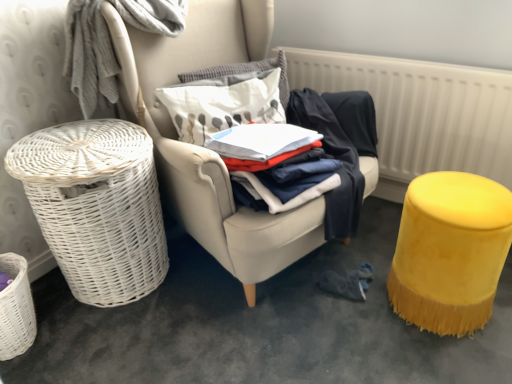
At what (x,y) coordinates should I click in order to perform the action: click on free space above white textured radiator at upper right (from a real-world perspective). Please return your answer as a coordinate pair (x, y). The image size is (512, 384). Looking at the image, I should click on (380, 53).